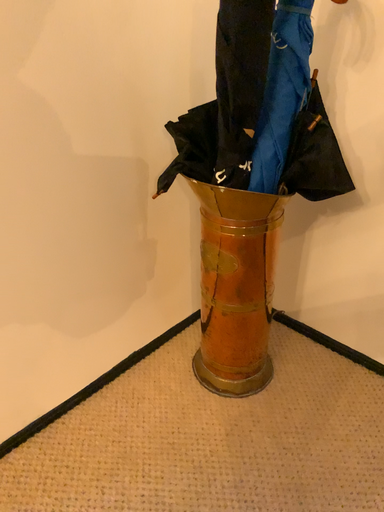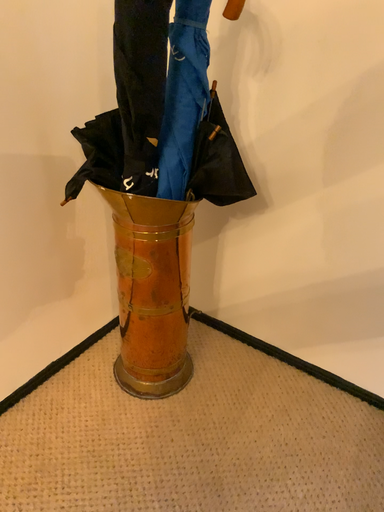
Question: How did the camera likely rotate when shooting the video?

Choices:
 (A) rotated right
 (B) rotated left

Answer: (A)